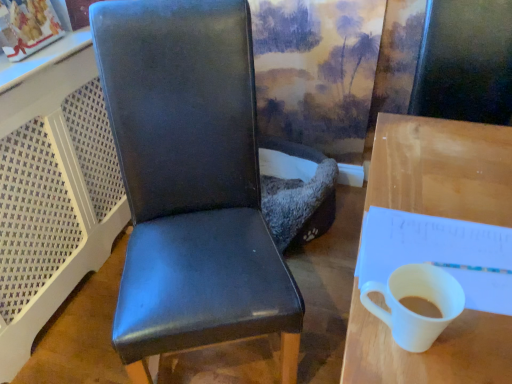
I want to click on white paper notepad at right, so click(440, 253).

The image size is (512, 384). I want to click on white glossy mug at right, so click(413, 312).

At what (x,y) coordinates should I click in order to perform the action: click on white paper notepad at right. Please return your answer as a coordinate pair (x, y). Looking at the image, I should click on (440, 253).

Considering the relative positions of white glossy mug at right and wooden desk at right in the image provided, is white glossy mug at right to the left or to the right of wooden desk at right?

Based on their positions, white glossy mug at right is located to the left of wooden desk at right.

Is point (367, 290) closer to viewer compared to point (354, 315)?

That is False.

Is white glossy mug at right wider or thinner than wooden desk at right?

white glossy mug at right is thinner than wooden desk at right.

How much distance is there between white glossy mug at right and wooden desk at right?

white glossy mug at right is 16.51 inches away from wooden desk at right.

Between matte black chair at center and white paper notepad at right, which one appears on the right side from the viewer's perspective?

Positioned to the right is white paper notepad at right.

Consider the image. From the image's perspective, is matte black chair at center below white paper notepad at right?

No, from the image's perspective, matte black chair at center is not beneath white paper notepad at right.

In order to click on notepad behind the matte black chair at center in this screenshot , I will do `click(440, 253)`.

Is matte black chair at center turned away from white paper notepad at right?

No, matte black chair at center is not facing away from white paper notepad at right.

Which object is positioned more to the right, wooden desk at right or white glossy mug at right?

wooden desk at right.

Which of these two, wooden desk at right or white glossy mug at right, stands shorter?

Standing shorter between the two is white glossy mug at right.

Considering the sizes of objects wooden desk at right and white glossy mug at right in the image provided, who is bigger, wooden desk at right or white glossy mug at right?

Bigger between the two is wooden desk at right.

Can we say wooden desk at right lies outside white glossy mug at right?

Yes, wooden desk at right is not within white glossy mug at right.

From a real-world perspective, between wooden desk at right and white paper notepad at right, who is vertically higher?

In real-world perspective, white paper notepad at right is above.

Considering the positions of objects wooden desk at right and white paper notepad at right in the image provided, who is more to the left, wooden desk at right or white paper notepad at right?

From the viewer's perspective, white paper notepad at right appears more on the left side.

Is wooden desk at right next to white paper notepad at right and touching it?

No, wooden desk at right is not with white paper notepad at right.

Does wooden desk at right come in front of white paper notepad at right?

Yes, it is.

From a real-world perspective, does white glossy mug at right stand above matte black chair at center?

Yes, from a real-world perspective, white glossy mug at right is on top of matte black chair at center.

Relative to matte black chair at center, is white glossy mug at right in front or behind?

Visually, white glossy mug at right is located in front of matte black chair at center.

Which object is thinner, white glossy mug at right or matte black chair at center?

With smaller width is white glossy mug at right.

Is white glossy mug at right aimed at matte black chair at center?

No, white glossy mug at right is not facing towards matte black chair at center.

Does white paper notepad at right have a larger size compared to matte black chair at center?

No.

Is white paper notepad at right oriented towards matte black chair at center?

No, white paper notepad at right is not facing towards matte black chair at center.

Does white paper notepad at right have a greater height compared to matte black chair at center?

No.

How distant is white glossy mug at right from white paper notepad at right?

white glossy mug at right is 5.75 inches away from white paper notepad at right.

From the picture: From a real-world perspective, is white glossy mug at right physically above white paper notepad at right?

Yes, from a real-world perspective, white glossy mug at right is over white paper notepad at right

This screenshot has width=512, height=384. In order to click on notepad above the white glossy mug at right (from the image's perspective) in this screenshot , I will do `click(440, 253)`.

Does point (389, 305) lie in front of point (498, 229)?

Yes, point (389, 305) is closer to viewer.

This screenshot has width=512, height=384. What are the coordinates of `coffee cup to the left of wooden desk at right` in the screenshot? It's located at pyautogui.click(x=413, y=312).

Where is `chair below the white paper notepad at right (from a real-world perspective)`? Image resolution: width=512 pixels, height=384 pixels. chair below the white paper notepad at right (from a real-world perspective) is located at coordinates (190, 182).

In the scene shown: Estimate the real-world distances between objects in this image. Which object is closer to matte black chair at center, white glossy mug at right or wooden desk at right?

wooden desk at right is closer to matte black chair at center.

Looking at the image, which one is located further to white glossy mug at right, matte black chair at center or wooden desk at right?

matte black chair at center lies further to white glossy mug at right than the other object.

Considering their positions, is white paper notepad at right positioned further to white glossy mug at right than matte black chair at center?

Based on the image, matte black chair at center appears to be further to white glossy mug at right.

Looking at the image, which one is located further to matte black chair at center, white glossy mug at right or white paper notepad at right?

white glossy mug at right.

When comparing their distances from white paper notepad at right, does matte black chair at center or white glossy mug at right seem further?

Among the two, matte black chair at center is located further to white paper notepad at right.

When comparing their distances from white glossy mug at right, does wooden desk at right or white paper notepad at right seem closer?

Among the two, white paper notepad at right is located nearer to white glossy mug at right.

From the image, which object appears to be farther from matte black chair at center, white paper notepad at right or wooden desk at right?

Among the two, wooden desk at right is located further to matte black chair at center.

Consider the image. When comparing their distances from matte black chair at center, does white paper notepad at right or white glossy mug at right seem closer?

The object closer to matte black chair at center is white paper notepad at right.

Where is `coffee cup between matte black chair at center and white paper notepad at right`? coffee cup between matte black chair at center and white paper notepad at right is located at coordinates (413, 312).

This screenshot has height=384, width=512. Find the location of `notepad between white glossy mug at right and wooden desk at right in the horizontal direction`. notepad between white glossy mug at right and wooden desk at right in the horizontal direction is located at coordinates (440, 253).

Where is `coffee cup located between matte black chair at center and wooden desk at right in the left-right direction`? This screenshot has width=512, height=384. coffee cup located between matte black chair at center and wooden desk at right in the left-right direction is located at coordinates (413, 312).

Locate an element on the screen. notepad located between matte black chair at center and wooden desk at right in the left-right direction is located at coordinates (440, 253).